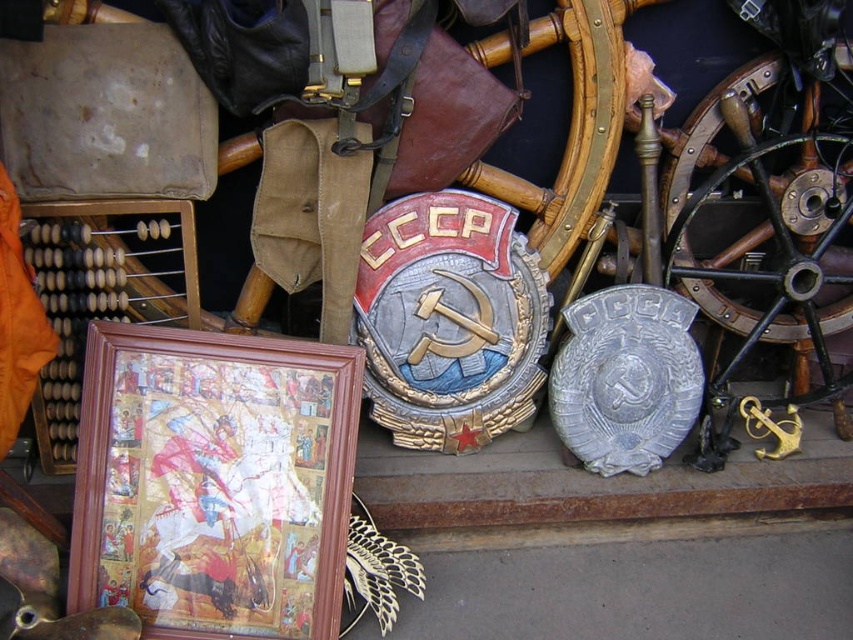
Question: Is wooden frame at lower left below polished brass wheel at right?

Choices:
 (A) yes
 (B) no

Answer: (A)

Question: Does wooden frame at lower left appear over polished brass wheel at right?

Choices:
 (A) yes
 (B) no

Answer: (B)

Question: Which object is closer to the camera taking this photo?

Choices:
 (A) wooden frame at lower left
 (B) polished brass wheel at right

Answer: (A)

Question: Can you confirm if wooden frame at lower left is positioned to the right of polished brass wheel at right?

Choices:
 (A) no
 (B) yes

Answer: (A)

Question: Which object is closer to the camera taking this photo?

Choices:
 (A) wooden frame at lower left
 (B) polished brass wheel at right

Answer: (A)